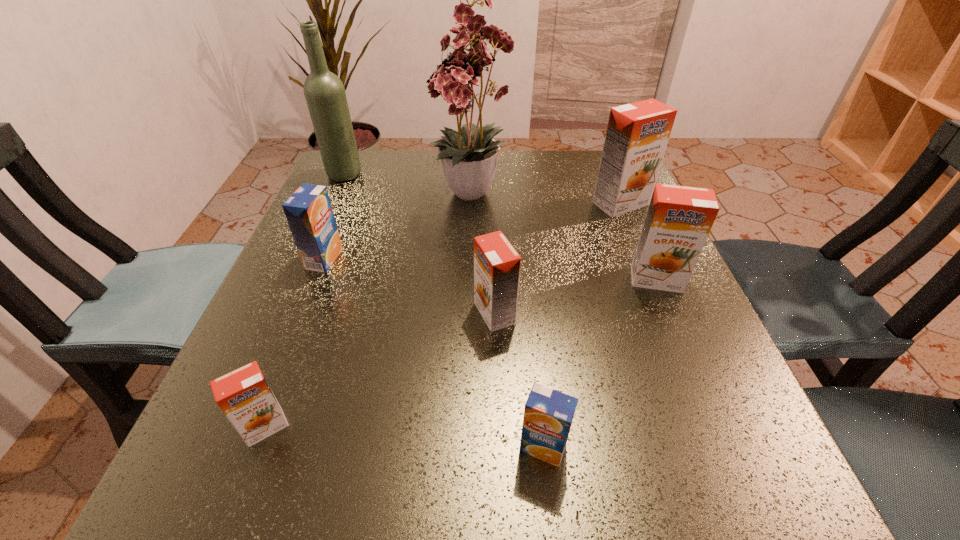
The height and width of the screenshot is (540, 960). Identify the location of flower arrangement. (469, 161).

Identify the location of pink flower arrangement. 469,161.

Image resolution: width=960 pixels, height=540 pixels. I want to click on the second tallest object, so click(324, 92).

Locate an element on the screen. The height and width of the screenshot is (540, 960). wine bottle is located at coordinates (324, 92).

In order to click on the biggest orange orange juice in this screenshot , I will do `click(637, 135)`.

Find the location of a particular element. The image size is (960, 540). the sixth shortest object is located at coordinates (637, 135).

Where is `the second farthest orange orange juice`? This screenshot has width=960, height=540. the second farthest orange orange juice is located at coordinates (679, 219).

This screenshot has width=960, height=540. Find the location of `the second tallest orange juice`. the second tallest orange juice is located at coordinates (679, 219).

Where is `the left blue orange_juice`? The width and height of the screenshot is (960, 540). the left blue orange_juice is located at coordinates (308, 211).

You are a GUI agent. You are given a task and a screenshot of the screen. Output one action in this format:
    pyautogui.click(x=<x>, y=<y>)
    Task: Click on the farther blue orange_juice
    The width and height of the screenshot is (960, 540).
    Given the screenshot: What is the action you would take?
    pyautogui.click(x=308, y=211)